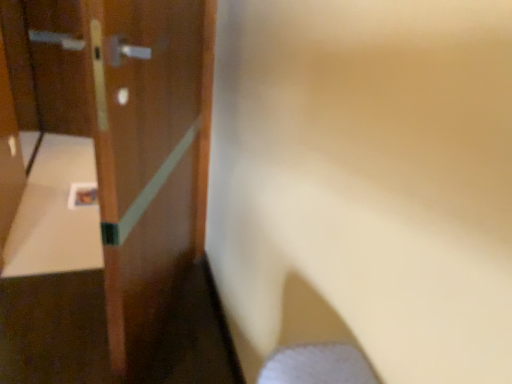
Question: Should I look upward or downward to see wooden door at left?

Choices:
 (A) down
 (B) up

Answer: (A)